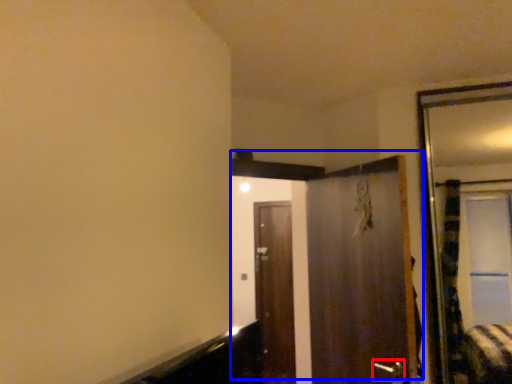
Question: Which point is closer to the camera, door handle (highlighted by a red box) or door (highlighted by a blue box)?

Choices:
 (A) door handle
 (B) door

Answer: (A)